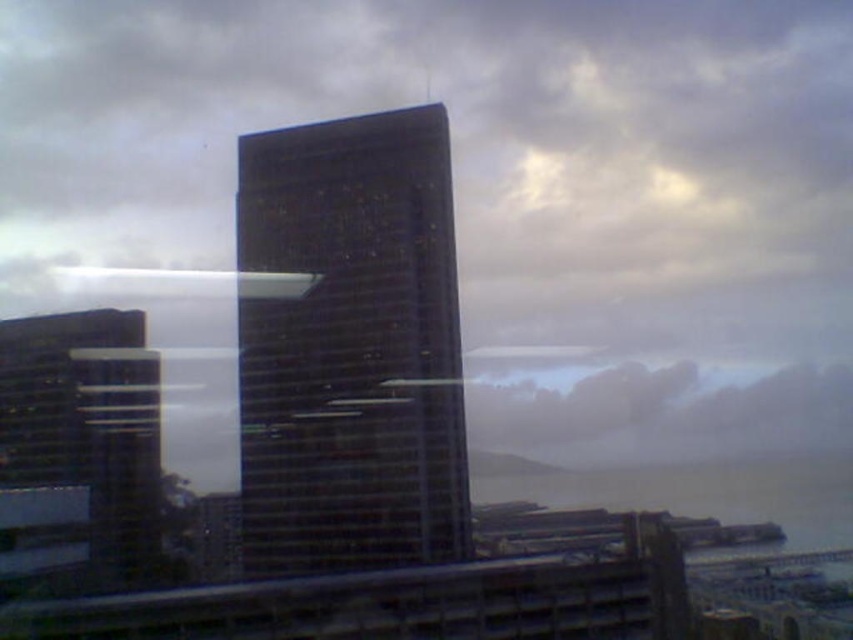
Is dark glass skyscraper at center shorter than glassy reflective skyscraper at left?

No.

Between point (422, 513) and point (27, 438), which one is positioned in front?

Positioned in front is point (422, 513).

The height and width of the screenshot is (640, 853). In order to click on dark glass skyscraper at center in this screenshot , I will do `click(351, 348)`.

Is glassy reflective skyscraper at left to the right of gray water at lower right from the viewer's perspective?

In fact, glassy reflective skyscraper at left is to the left of gray water at lower right.

Does glassy reflective skyscraper at left have a smaller size compared to gray water at lower right?

Yes, glassy reflective skyscraper at left is smaller than gray water at lower right.

Between point (79, 419) and point (770, 506), which one is positioned behind?

The point (770, 506) is more distant.

Where is `glassy reflective skyscraper at left`? glassy reflective skyscraper at left is located at coordinates (88, 429).

Is dark glass skyscraper at center closer to camera compared to gray water at lower right?

Yes.

Who is positioned more to the left, dark glass skyscraper at center or gray water at lower right?

From the viewer's perspective, dark glass skyscraper at center appears more on the left side.

Locate an element on the screen. This screenshot has height=640, width=853. dark glass skyscraper at center is located at coordinates (351, 348).